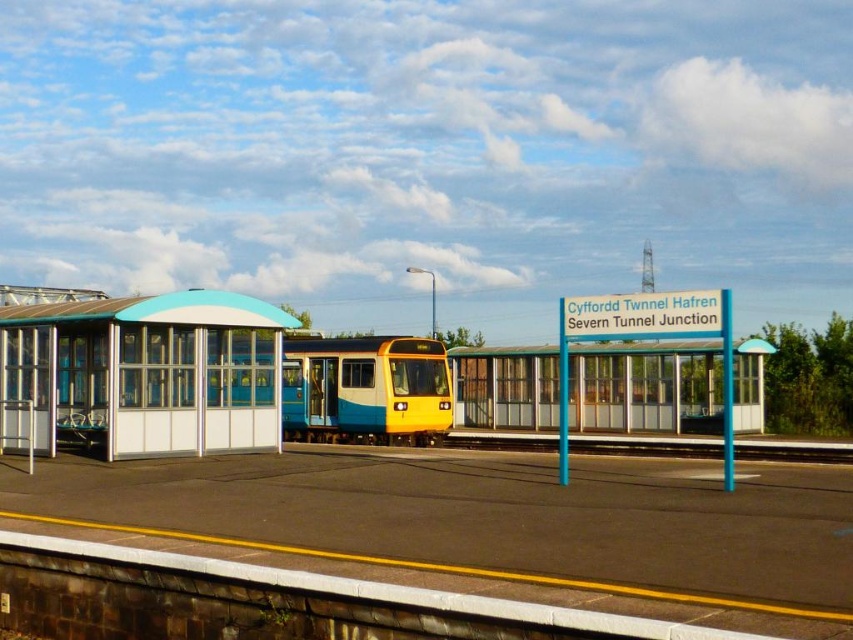
Is blue glass bus stop at center below metal train track at center?

No.

Measure the distance between blue glass bus stop at center and metal train track at center.

blue glass bus stop at center is 4.06 meters away from metal train track at center.

Is point (633, 314) farther from camera compared to point (663, 440)?

No, it is not.

This screenshot has width=853, height=640. I want to click on blue glass bus stop at center, so click(x=646, y=339).

Which is more to the right, white glass bus station at left or metal train track at center?

From the viewer's perspective, metal train track at center appears more on the right side.

Does point (202, 365) lie behind point (569, 444)?

No, it is not.

Locate an element on the screen. The width and height of the screenshot is (853, 640). white glass bus station at left is located at coordinates (148, 371).

What are the coordinates of `white glass bus station at left` in the screenshot? It's located at 148,371.

Who is more distant from viewer, (310, 396) or (668, 298)?

Positioned behind is point (310, 396).

Is yellow matte passenger train at center smaller than blue glass bus stop at center?

Yes.

Measure the distance between yellow matte passenger train at center and camera.

yellow matte passenger train at center is 22.22 meters from camera.

I want to click on yellow matte passenger train at center, so click(x=364, y=388).